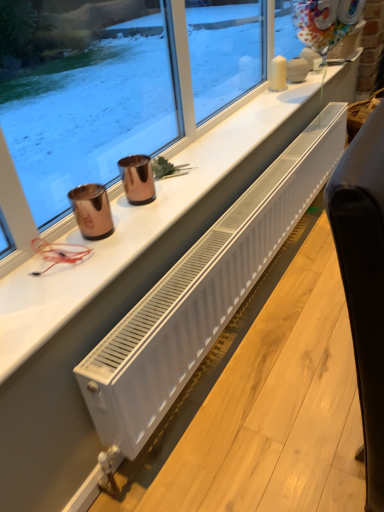
Identify the location of white plastic radiator at center. Image resolution: width=384 pixels, height=512 pixels. (202, 292).

Describe the element at coordinates (202, 292) in the screenshot. Image resolution: width=384 pixels, height=512 pixels. I see `white plastic radiator at center` at that location.

Image resolution: width=384 pixels, height=512 pixels. What are the coordinates of `white plastic radiator at center` in the screenshot? It's located at (202, 292).